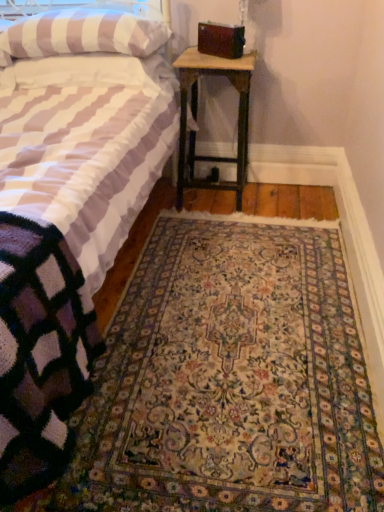
The width and height of the screenshot is (384, 512). What do you see at coordinates (196, 117) in the screenshot?
I see `wooden nightstand at lower right` at bounding box center [196, 117].

The image size is (384, 512). Describe the element at coordinates (83, 33) in the screenshot. I see `striped fabric pillow at upper left` at that location.

This screenshot has height=512, width=384. What do you see at coordinates (58, 263) in the screenshot?
I see `striped fabric bed at center` at bounding box center [58, 263].

Where is `wooden nightstand at lower right`? wooden nightstand at lower right is located at coordinates (196, 117).

Is striped fabric bed at center completely or partially outside of carpeted rug at center?

striped fabric bed at center lies outside carpeted rug at center's area.

Is striped fabric bed at center with carpeted rug at center?

striped fabric bed at center is not next to carpeted rug at center, and they're not touching.

Does striped fabric bed at center have a smaller size compared to carpeted rug at center?

Actually, striped fabric bed at center might be larger than carpeted rug at center.

Where is `bed located in front of the carpeted rug at center`? This screenshot has height=512, width=384. bed located in front of the carpeted rug at center is located at coordinates (58, 263).

Can you tell me how much striped fabric pillow at upper left and wooden nightstand at lower right differ in facing direction?

striped fabric pillow at upper left and wooden nightstand at lower right are facing 1.59 degrees away from each other.

From the picture: Between striped fabric pillow at upper left and wooden nightstand at lower right, which one appears on the left side from the viewer's perspective?

From the viewer's perspective, striped fabric pillow at upper left appears more on the left side.

Is striped fabric pillow at upper left bigger than wooden nightstand at lower right?

No.

Is point (87, 46) positioned behind point (196, 87)?

No, it is in front of (196, 87).

Where is `nightstand to the right of striped fabric bed at center`? This screenshot has width=384, height=512. nightstand to the right of striped fabric bed at center is located at coordinates (196, 117).

Consider the image. Considering the sizes of objects wooden nightstand at lower right and striped fabric bed at center in the image provided, who is wider, wooden nightstand at lower right or striped fabric bed at center?

striped fabric bed at center.

How many degrees apart are the facing directions of wooden nightstand at lower right and striped fabric bed at center?

The angle between the facing direction of wooden nightstand at lower right and the facing direction of striped fabric bed at center is 1.59 degrees.

Which is behind, point (250, 56) or point (14, 119)?

Point (250, 56)

From a real-world perspective, which is physically above, carpeted rug at center or wooden nightstand at lower right?

wooden nightstand at lower right.

Considering the positions of objects carpeted rug at center and wooden nightstand at lower right in the image provided, who is more to the right, carpeted rug at center or wooden nightstand at lower right?

Positioned to the right is carpeted rug at center.

Is carpeted rug at center next to wooden nightstand at lower right and touching it?

carpeted rug at center and wooden nightstand at lower right are not in contact.

Considering the points (269, 404) and (180, 163), which point is behind, point (269, 404) or point (180, 163)?

The point (180, 163) is more distant.

Who is more distant, wooden nightstand at lower right or carpeted rug at center?

wooden nightstand at lower right.

Based on the photo, which is nearer, (240, 184) or (233, 454)?

Point (240, 184) appears to be farther away from the viewer than point (233, 454).

Is wooden nightstand at lower right next to carpeted rug at center and touching it?

wooden nightstand at lower right and carpeted rug at center are not in contact.

At what (x,y) coordinates should I click in order to perform the action: click on nightstand above the carpeted rug at center (from the image's perspective). Please return your answer as a coordinate pair (x, y). Looking at the image, I should click on (196, 117).

Which is closer to the camera, [59,18] or [14,144]?

Point [59,18] is farther from the camera than point [14,144].

Is striped fabric pillow at upper left aimed at striped fabric bed at center?

Yes, striped fabric pillow at upper left is aimed at striped fabric bed at center.

Who is shorter, striped fabric pillow at upper left or striped fabric bed at center?

striped fabric pillow at upper left is shorter.

Where is `pillow behind the striped fabric bed at center`? pillow behind the striped fabric bed at center is located at coordinates (83, 33).

Which of these two, striped fabric bed at center or wooden nightstand at lower right, is bigger?

striped fabric bed at center.

From a real-world perspective, relative to wooden nightstand at lower right, is striped fabric bed at center vertically above or below?

In terms of real-world spatial position, striped fabric bed at center is above wooden nightstand at lower right.

Is striped fabric bed at center positioned beyond the bounds of wooden nightstand at lower right?

striped fabric bed at center is positioned outside wooden nightstand at lower right.

Is striped fabric bed at center in contact with wooden nightstand at lower right?

striped fabric bed at center is not next to wooden nightstand at lower right, and they're not touching.

Find the location of a particular element. This screenshot has width=384, height=512. bed in front of the carpeted rug at center is located at coordinates pyautogui.click(x=58, y=263).

The image size is (384, 512). I want to click on nightstand lying below the striped fabric pillow at upper left (from the image's perspective), so click(x=196, y=117).

Considering their positions, is wooden nightstand at lower right positioned further to striped fabric bed at center than carpeted rug at center?

Among the two, wooden nightstand at lower right is located further to striped fabric bed at center.

Estimate the real-world distances between objects in this image. Which object is further from carpeted rug at center, striped fabric bed at center or wooden nightstand at lower right?

wooden nightstand at lower right is positioned further to the anchor carpeted rug at center.

Based on their spatial positions, is carpeted rug at center or striped fabric bed at center closer to wooden nightstand at lower right?

striped fabric bed at center is closer to wooden nightstand at lower right.

Considering their positions, is wooden nightstand at lower right positioned further to striped fabric pillow at upper left than striped fabric bed at center?

Among the two, wooden nightstand at lower right is located further to striped fabric pillow at upper left.

Which object lies nearer to the anchor point striped fabric bed at center, wooden nightstand at lower right or striped fabric pillow at upper left?

striped fabric pillow at upper left is positioned closer to the anchor striped fabric bed at center.

Consider the image. When comparing their distances from wooden nightstand at lower right, does striped fabric bed at center or striped fabric pillow at upper left seem closer?

The object closer to wooden nightstand at lower right is striped fabric pillow at upper left.

Consider the image. Considering their positions, is carpeted rug at center positioned further to striped fabric pillow at upper left than striped fabric bed at center?

The object further to striped fabric pillow at upper left is carpeted rug at center.

Considering their positions, is striped fabric bed at center positioned further to wooden nightstand at lower right than carpeted rug at center?

carpeted rug at center lies further to wooden nightstand at lower right than the other object.

Locate an element on the screen. The width and height of the screenshot is (384, 512). mat between striped fabric bed at center and wooden nightstand at lower right in the front-back direction is located at coordinates (229, 379).

This screenshot has width=384, height=512. What are the coordinates of `mat between striped fabric bed at center and striped fabric pillow at upper left along the z-axis` in the screenshot? It's located at (229, 379).

The width and height of the screenshot is (384, 512). In order to click on nightstand that lies between striped fabric pillow at upper left and carpeted rug at center from top to bottom in this screenshot , I will do click(196, 117).

Identify the location of pillow positioned between striped fabric bed at center and wooden nightstand at lower right from near to far. The height and width of the screenshot is (512, 384). (83, 33).